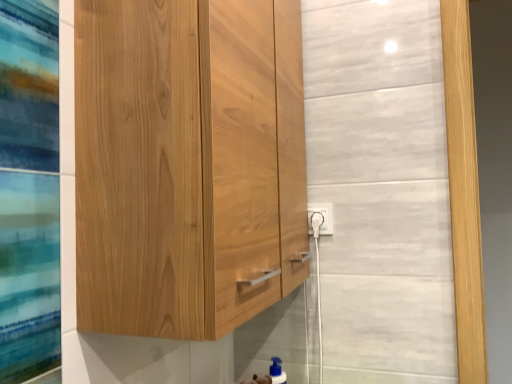
What do you see at coordinates (188, 164) in the screenshot? The image size is (512, 384). I see `natural wood cabinet at center` at bounding box center [188, 164].

At what (x,y) coordinates should I click in order to perform the action: click on natural wood cabinet at center. Please return your answer as a coordinate pair (x, y). This screenshot has width=512, height=384. Looking at the image, I should click on (188, 164).

Find the location of a particular element. natural wood cabinet at center is located at coordinates (188, 164).